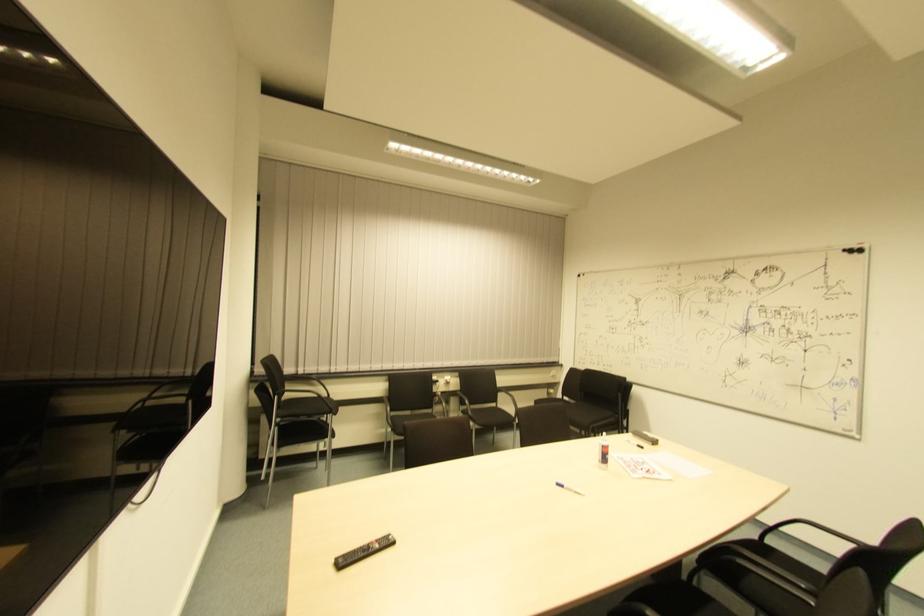
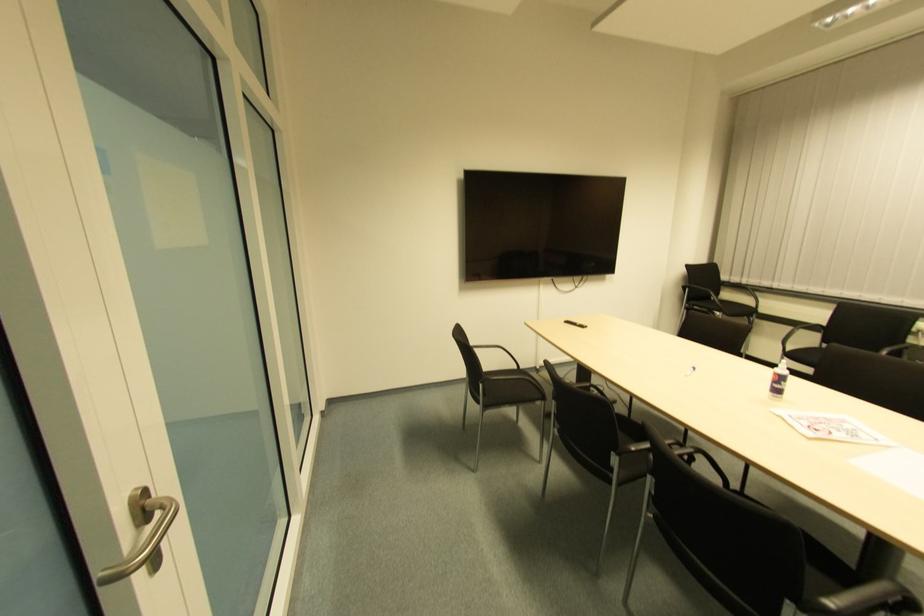
Where in the second image is the point corresponding to point (555, 488) from the first image?

(691, 371)